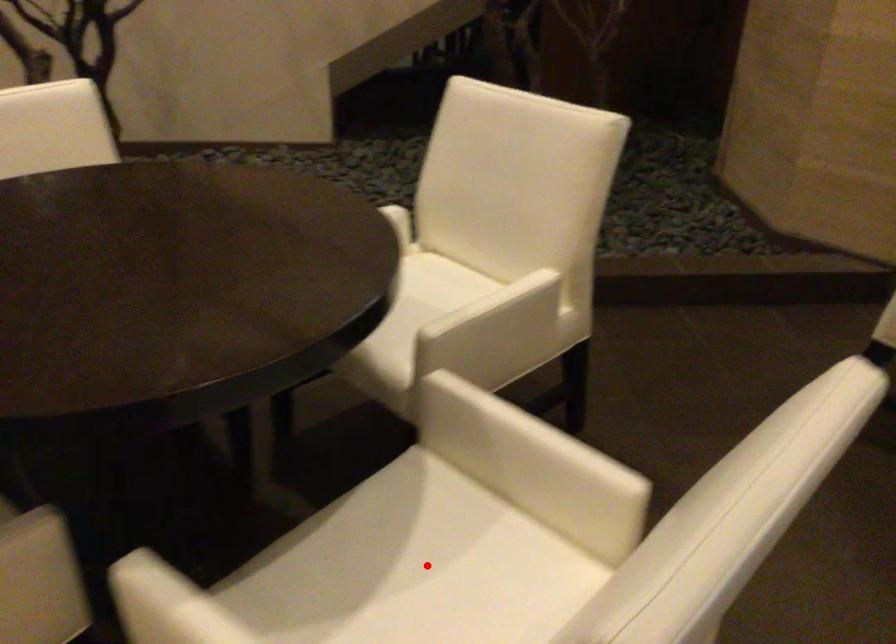
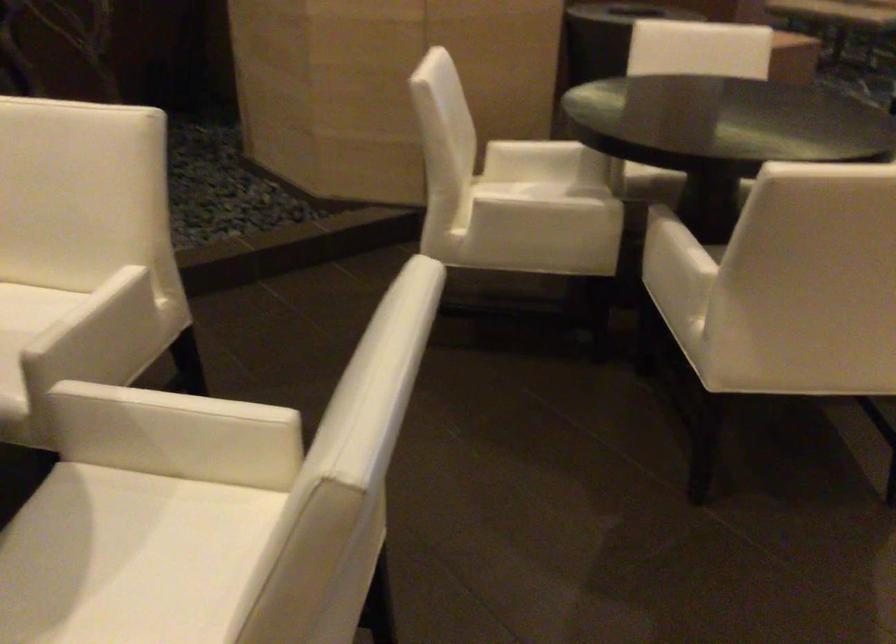
Locate, in the second image, the point that corresponds to the highlighted location in the first image.

(122, 558)